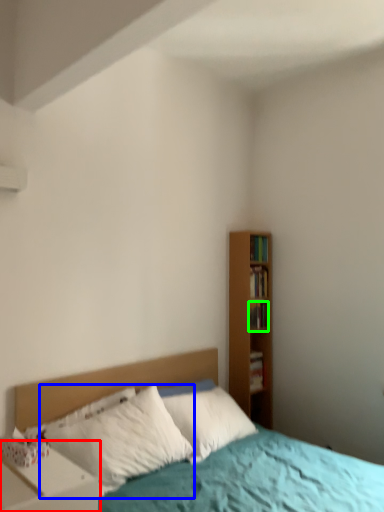
Question: Based on their relative distances, which object is farther from nightstand (highlighted by a red box)? Choose from pillow (highlighted by a blue box) and book (highlighted by a green box).

Choices:
 (A) pillow
 (B) book

Answer: (B)